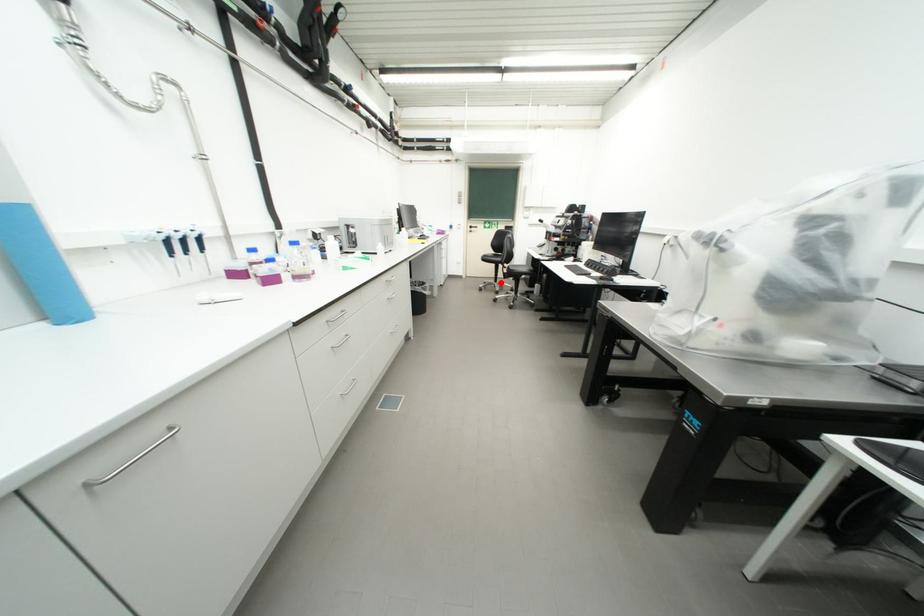
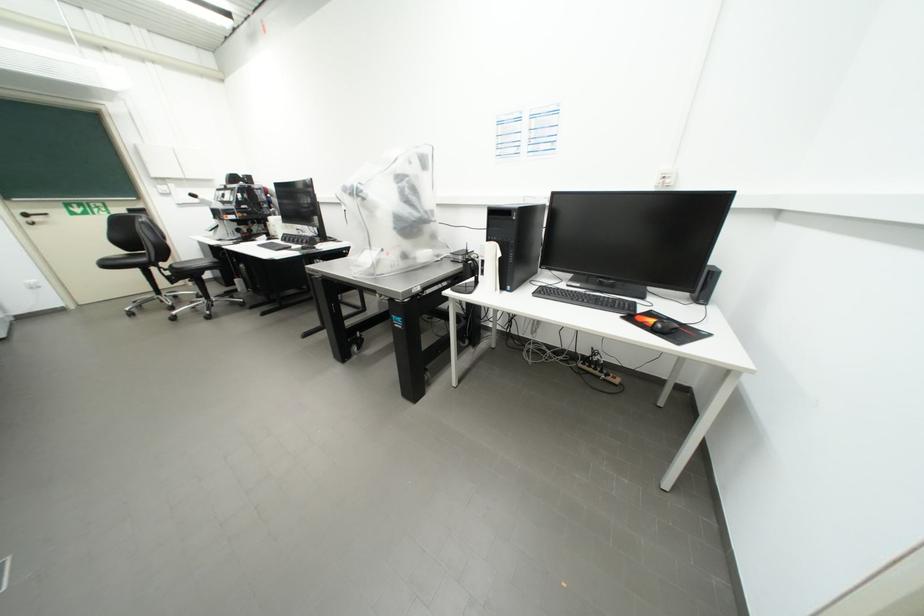
Question: I am providing you with two images of the same scene from different viewpoints. Given a red point in image1, look at the same physical point in image2. Is it:

Choices:
 (A) Closer to the viewpoint
 (B) Farther from the viewpoint

Answer: (B)